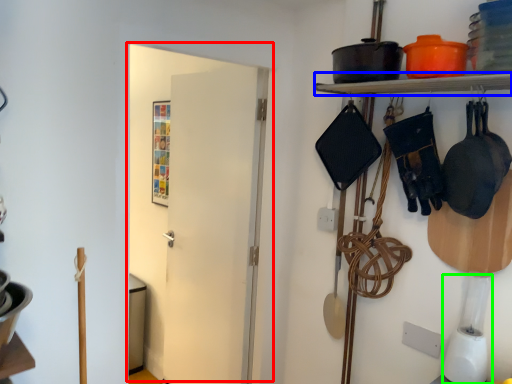
Question: Which object is the closest to the door (highlighted by a red box)? Choose among these: shelf (highlighted by a blue box) or appliance (highlighted by a green box).

Choices:
 (A) shelf
 (B) appliance

Answer: (A)